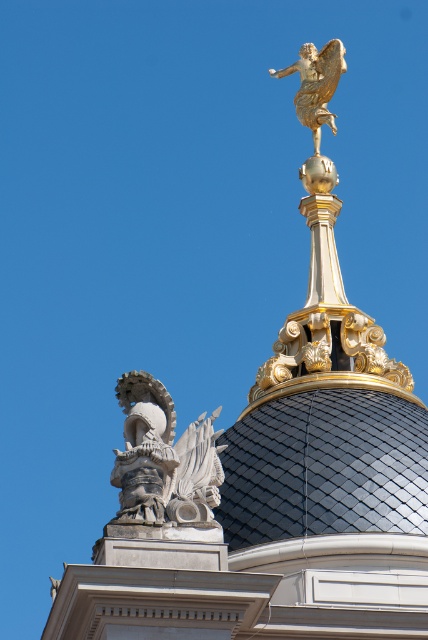
Question: Which object is closer to the camera taking this photo?

Choices:
 (A) gold metallic angel at upper center
 (B) white stone eagle at lower left

Answer: (B)

Question: Does white stone eagle at lower left appear on the right side of gold metallic angel at upper center?

Choices:
 (A) no
 (B) yes

Answer: (A)

Question: Is white stone eagle at lower left above gold metallic angel at upper center?

Choices:
 (A) no
 (B) yes

Answer: (A)

Question: Does white stone eagle at lower left appear over gold metallic angel at upper center?

Choices:
 (A) no
 (B) yes

Answer: (A)